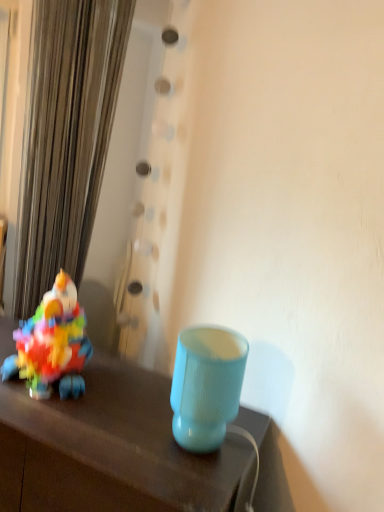
Question: Should I look upward or downward to see matte blue lampshade at center?

Choices:
 (A) up
 (B) down

Answer: (B)

Question: Is multicolored plastic toy at left closer to the viewer compared to matte plastic lamp at lower right?

Choices:
 (A) yes
 (B) no

Answer: (B)

Question: Can you confirm if multicolored plastic toy at left is positioned to the left of matte plastic lamp at lower right?

Choices:
 (A) yes
 (B) no

Answer: (B)

Question: Does multicolored plastic toy at left appear on the right side of matte plastic lamp at lower right?

Choices:
 (A) yes
 (B) no

Answer: (A)

Question: From the image's perspective, is multicolored plastic toy at left under matte plastic lamp at lower right?

Choices:
 (A) yes
 (B) no

Answer: (B)

Question: Is multicolored plastic toy at left not inside matte plastic lamp at lower right?

Choices:
 (A) no
 (B) yes

Answer: (B)

Question: Is multicolored plastic toy at left bigger than matte plastic lamp at lower right?

Choices:
 (A) no
 (B) yes

Answer: (A)

Question: Could you tell me if matte plastic lamp at lower right is turned towards multicolored plastic toy at left?

Choices:
 (A) no
 (B) yes

Answer: (A)

Question: From a real-world perspective, is matte plastic lamp at lower right over multicolored plastic toy at left?

Choices:
 (A) yes
 (B) no

Answer: (B)

Question: Can you confirm if matte plastic lamp at lower right is thinner than multicolored plastic toy at left?

Choices:
 (A) yes
 (B) no

Answer: (B)

Question: Can you confirm if matte plastic lamp at lower right is smaller than multicolored plastic toy at left?

Choices:
 (A) yes
 (B) no

Answer: (B)

Question: Is matte plastic lamp at lower right not close to multicolored plastic toy at left?

Choices:
 (A) yes
 (B) no

Answer: (B)

Question: Is matte plastic lamp at lower right looking in the opposite direction of multicolored plastic toy at left?

Choices:
 (A) yes
 (B) no

Answer: (B)

Question: Is multicolored plastic toy at left wider than matte blue lampshade at center?

Choices:
 (A) no
 (B) yes

Answer: (A)